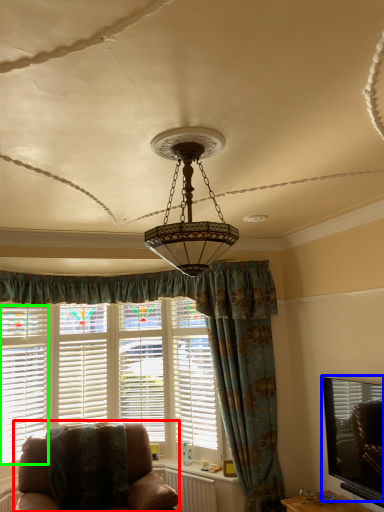
Question: Which object is positioned closest to chair (highlighted by a red box)? Select from window screen (highlighted by a blue box) and blind (highlighted by a green box).

Choices:
 (A) window screen
 (B) blind

Answer: (B)